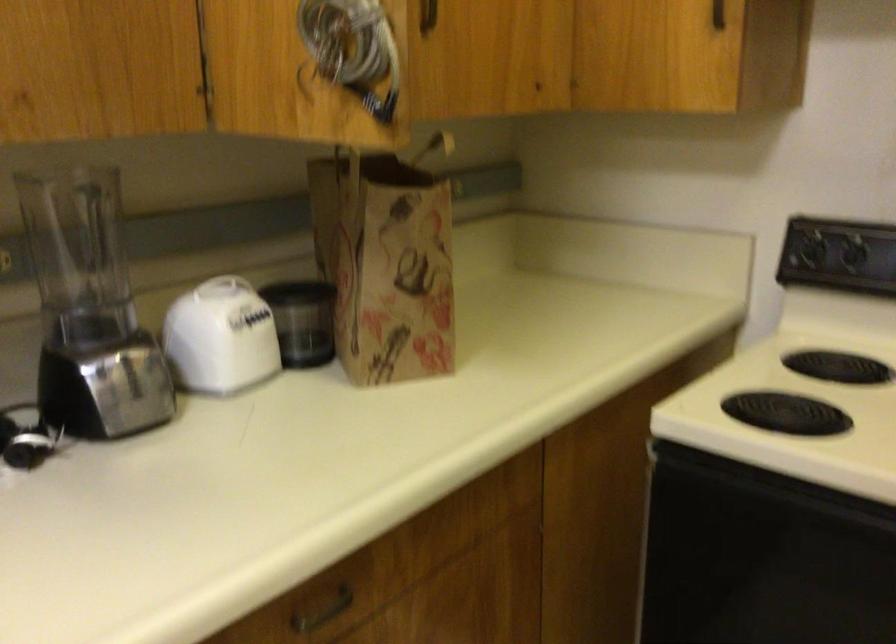
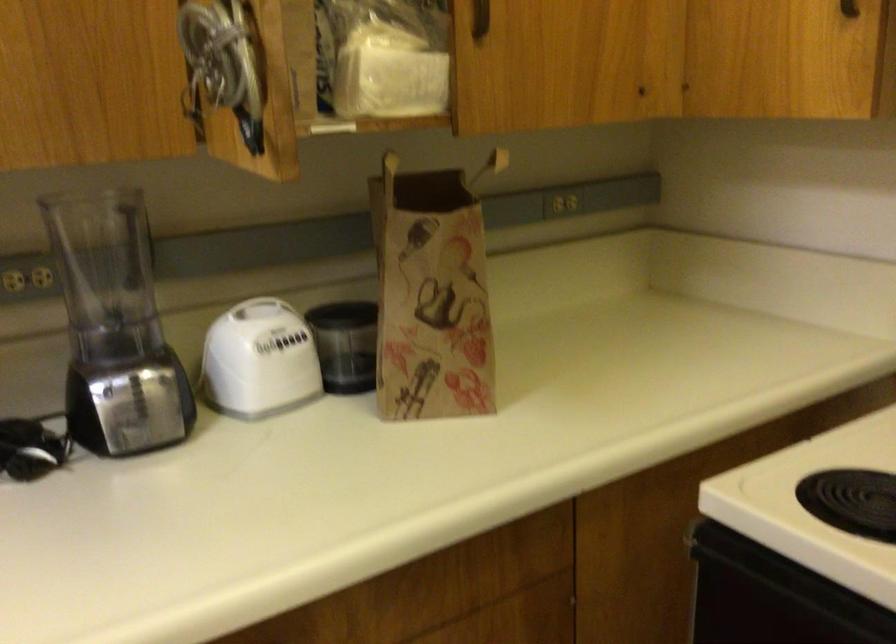
In the second image, find the point that corresponds to (x=99, y=310) in the first image.

(115, 327)